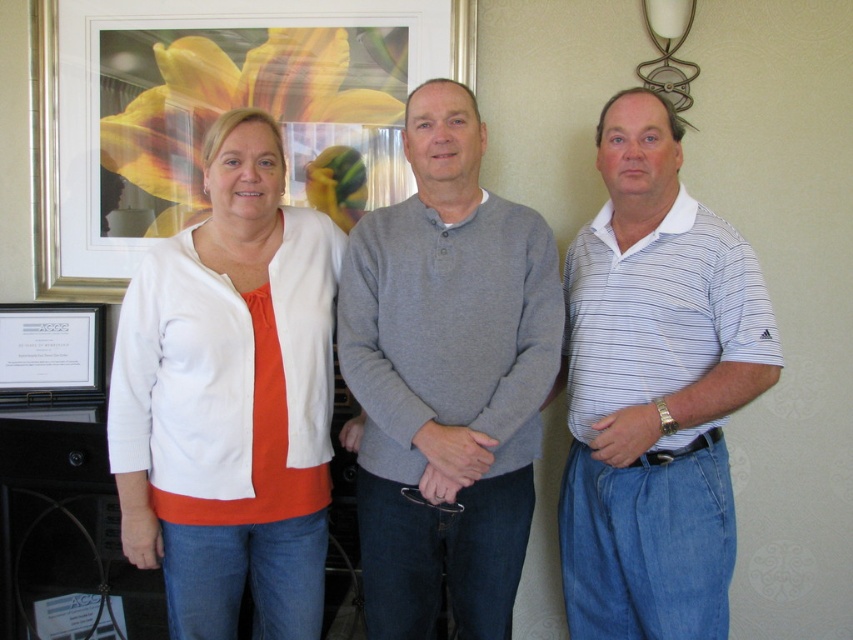
Question: Is gray cotton sweater at center bigger than white striped polo shirt at right?

Choices:
 (A) no
 (B) yes

Answer: (A)

Question: Which point is farther to the camera?

Choices:
 (A) metallic gold picture frame at upper center
 (B) gray cotton sweater at center
 (C) white matte cardigan at center
 (D) white cotton cardigan at center

Answer: (A)

Question: Is white striped polo shirt at right positioned at the back of metallic gold picture frame at upper center?

Choices:
 (A) yes
 (B) no

Answer: (B)

Question: Among these points, which one is nearest to the camera?

Choices:
 (A) (48, 141)
 (B) (596, 595)
 (C) (239, 412)
 (D) (480, 536)

Answer: (C)

Question: Can you confirm if white cotton cardigan at center is positioned below white paper at left?

Choices:
 (A) yes
 (B) no

Answer: (A)

Question: Which object is positioned farthest from the metallic gold picture frame at upper center?

Choices:
 (A) white cotton cardigan at center
 (B) white striped polo shirt at right

Answer: (B)